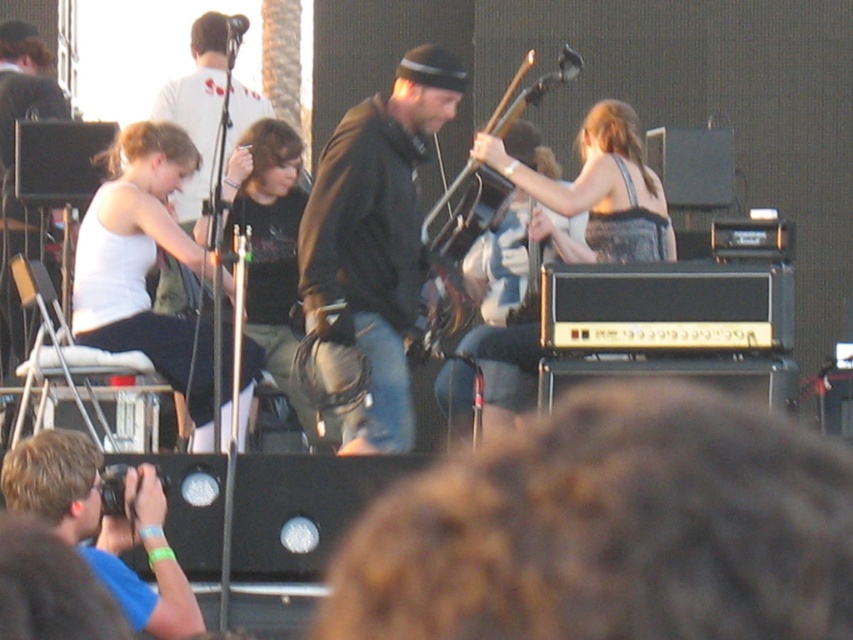
Question: Can you confirm if white fabric tank top at left is smaller than metallic black guitar at center?

Choices:
 (A) yes
 (B) no

Answer: (B)

Question: Which is farther from the dark brown leather jacket at center?

Choices:
 (A) metallic black guitar at center
 (B) white fabric tank top at left

Answer: (A)

Question: Does dark brown leather jacket at center have a larger size compared to white fabric tank top at left?

Choices:
 (A) no
 (B) yes

Answer: (A)

Question: Is white fabric tank top at left wider than metallic black guitar at center?

Choices:
 (A) no
 (B) yes

Answer: (B)

Question: Which is nearer to the white fabric tank top at left?

Choices:
 (A) metallic black guitar at center
 (B) dark brown leather jacket at center

Answer: (B)

Question: Which point is farther from the camera taking this photo?

Choices:
 (A) (144, 156)
 (B) (305, 228)
 (C) (537, 97)

Answer: (C)